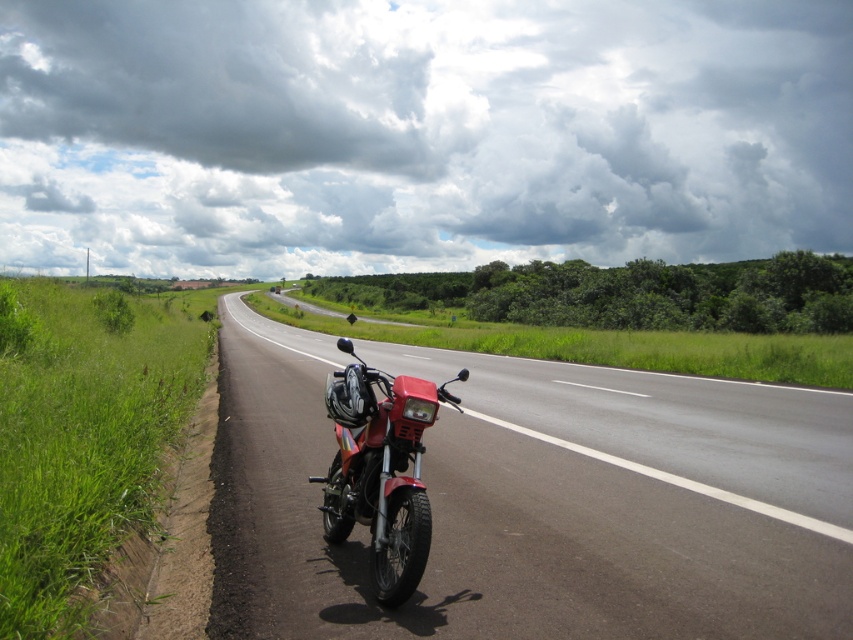
You are standing on the grassy area next to the smooth asphalt highway at center. You want to cross the highway to reach a friend on the other side. The highway has no traffic, but you need to ensure it is safe. What is the minimum distance you must walk straight across the highway to get to the other side?

The smooth asphalt highway at center is 4.01 meters wide, so you must walk straight across a distance of at least 4.01 meters to safely reach the other side.

You are a photographer planning to take a wide shot of the roadside scene. The green grass at left and the metallic red motorcycle at center are both in your frame. Based on their sizes in the image, which object would appear wider in the photo?

The green grass at left appears wider than the metallic red motorcycle at center in the photo because the green grass at left has a larger width.

You are standing at the point with coordinates point (90, 385) and want to walk to point (426, 417). Which direction should you move relative to the road?

Since point (90, 385) is closer to the viewer than point (426, 417), you should move away from the viewer along the road to reach point (426, 417).